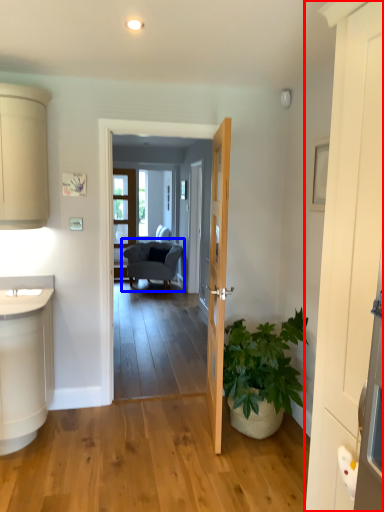
Question: Which of the following is the farthest to the observer, door (highlighted by a red box) or chair (highlighted by a blue box)?

Choices:
 (A) door
 (B) chair

Answer: (B)